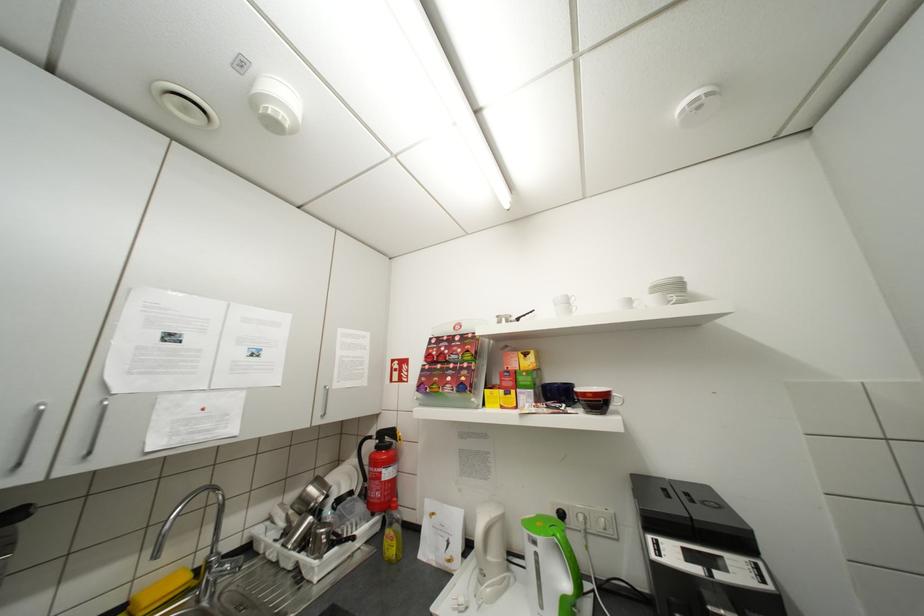
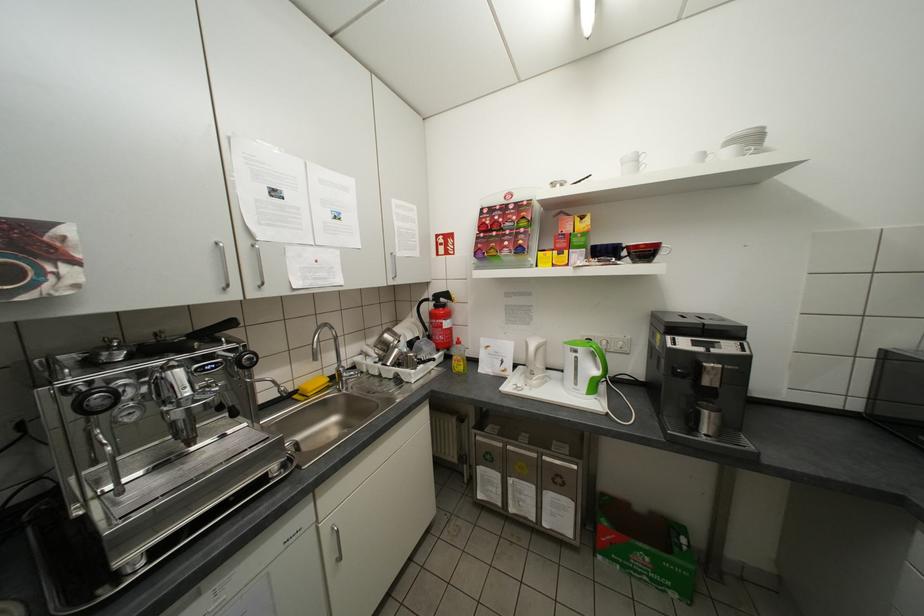
Locate, in the second image, the point that corresponds to the point at 538,541 in the first image.

(579, 351)